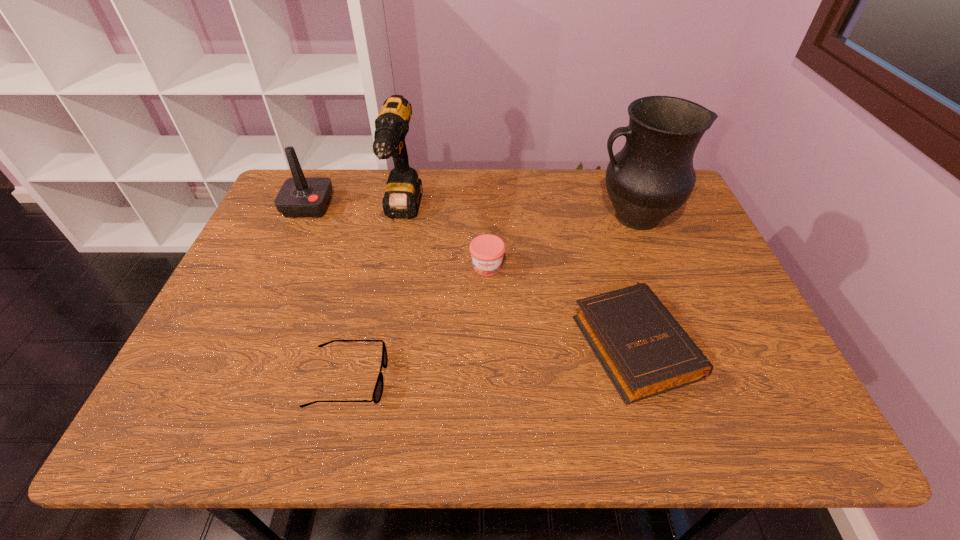
Locate an element on the screen. This screenshot has width=960, height=540. vacant space located 0.300m on the handle side of the pitcher is located at coordinates (490, 217).

Where is `free spot located at the tip of the drill`? free spot located at the tip of the drill is located at coordinates (388, 292).

What are the coordinates of `vacant space located on the right of the fourth shortest object` in the screenshot? It's located at (411, 206).

The height and width of the screenshot is (540, 960). What are the coordinates of `vacant space located on the front label of the jam` in the screenshot? It's located at (489, 336).

The height and width of the screenshot is (540, 960). I want to click on free region located 0.290m on the back of the second shortest object, so click(598, 218).

Find the location of `free space located 0.110m on the front-facing side of the spectacles`. free space located 0.110m on the front-facing side of the spectacles is located at coordinates (439, 379).

The image size is (960, 540). Find the location of `pitcher present at the far edge`. pitcher present at the far edge is located at coordinates (652, 176).

Where is `drill present at the far edge`? drill present at the far edge is located at coordinates (402, 198).

Where is `joystick at the far edge`? joystick at the far edge is located at coordinates (299, 197).

Where is `Bible positioned at the near edge`? The width and height of the screenshot is (960, 540). Bible positioned at the near edge is located at coordinates tap(645, 352).